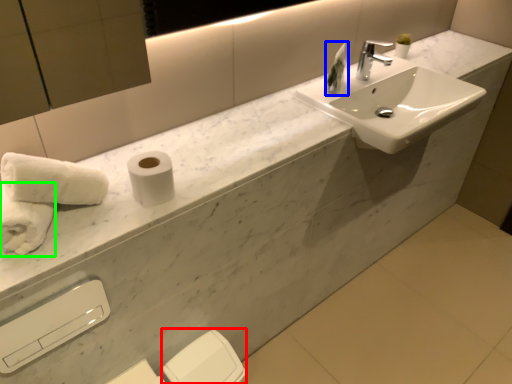
Question: Considering the real-world distances, which object is closest to toilet paper (highlighted by a red box)? toiletry (highlighted by a blue box) or bath towel (highlighted by a green box).

Choices:
 (A) toiletry
 (B) bath towel

Answer: (B)